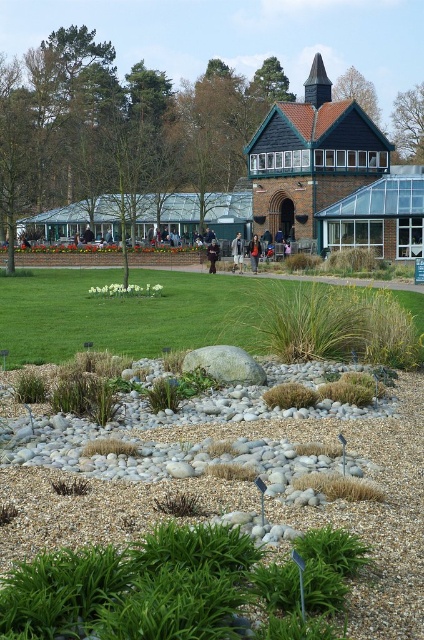
Question: Which is farther from the gray pebbles at center?

Choices:
 (A) green grass at center
 (B) brown leather jacket at center
 (C) light brown leather jacket at center

Answer: (C)

Question: Does gray pebbles at center have a larger size compared to green grass at center?

Choices:
 (A) no
 (B) yes

Answer: (A)

Question: Which point is farther from the camera taking this photo?

Choices:
 (A) (214, 260)
 (B) (200, 316)
 (C) (253, 253)

Answer: (C)

Question: Estimate the real-world distances between objects in this image. Which object is farther from the light brown leather jacket at center?

Choices:
 (A) gray pebbles at center
 (B) dark brown leather jacket at center
 (C) brown leather jacket at center

Answer: (A)

Question: Does light brown leather jacket at center have a lesser width compared to dark brown leather jacket at center?

Choices:
 (A) no
 (B) yes

Answer: (A)

Question: Does gray pebbles at center have a larger size compared to light brown leather jacket at center?

Choices:
 (A) no
 (B) yes

Answer: (A)